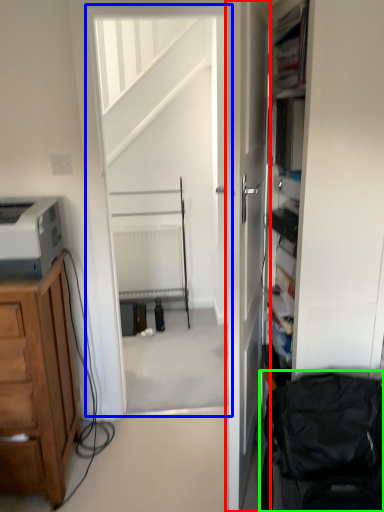
Question: Which is nearer to the door (highlighted by a red box)? screen door (highlighted by a blue box) or swivel chair (highlighted by a green box).

Choices:
 (A) screen door
 (B) swivel chair

Answer: (B)